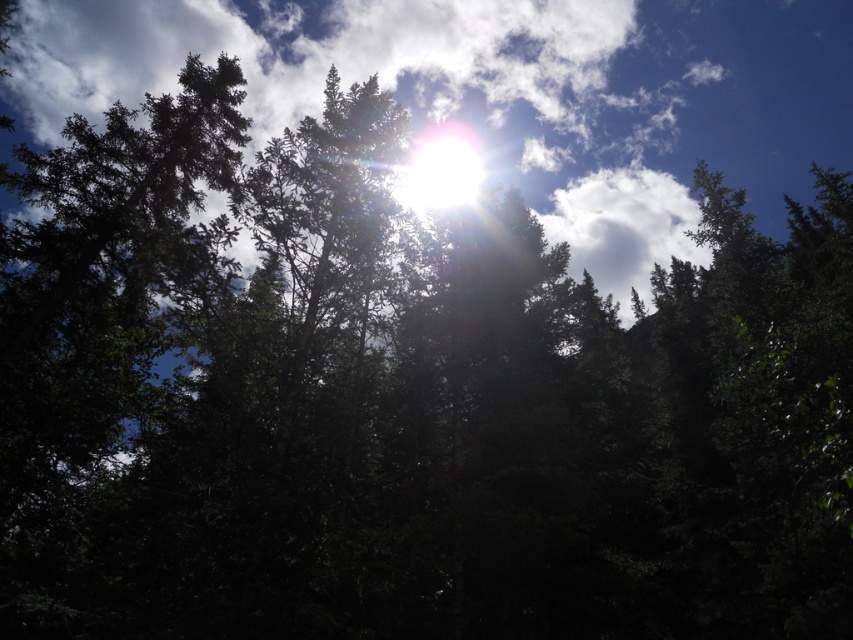
Question: Which point is closer to the camera?

Choices:
 (A) white fluffy cloud at upper center
 (B) bright white sun at upper center

Answer: (B)

Question: Is white fluffy cloud at upper center wider than bright white sun at upper center?

Choices:
 (A) no
 (B) yes

Answer: (B)

Question: Which of the following is the closest to the observer?

Choices:
 (A) bright white sun at upper center
 (B) white fluffy cloud at upper center

Answer: (A)

Question: Is white fluffy cloud at upper center to the left of bright white sun at upper center from the viewer's perspective?

Choices:
 (A) yes
 (B) no

Answer: (B)

Question: Can you confirm if white fluffy cloud at upper center is positioned above bright white sun at upper center?

Choices:
 (A) no
 (B) yes

Answer: (B)